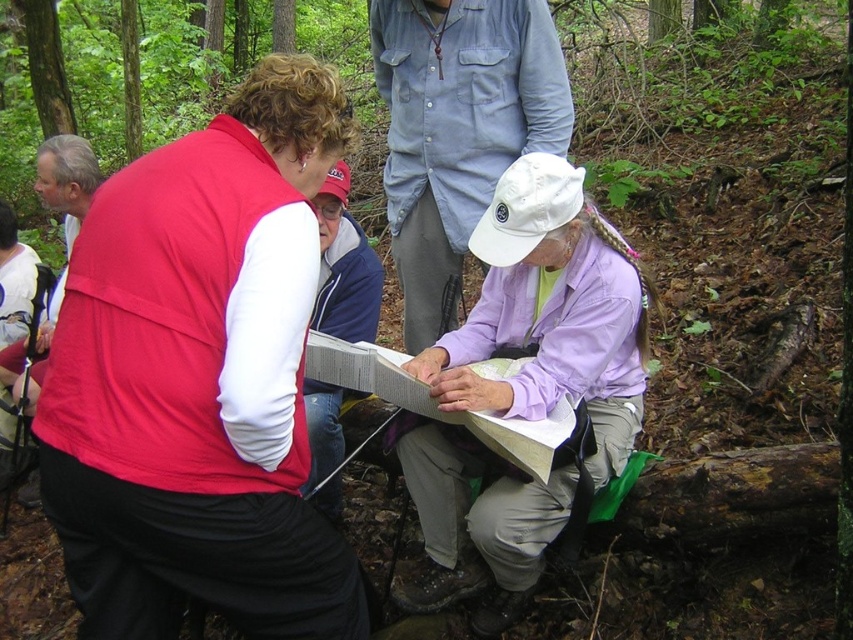
Question: Which is farther from the matte red vest at center?

Choices:
 (A) blue denim jacket at center
 (B) light blue denim shirt at upper center

Answer: (B)

Question: Observing the image, what is the correct spatial positioning of lavender fabric shirt at center in reference to light blue denim shirt at upper center?

Choices:
 (A) below
 (B) above

Answer: (A)

Question: Does lavender fabric shirt at center have a smaller size compared to white shirt at upper left?

Choices:
 (A) no
 (B) yes

Answer: (B)

Question: Which object appears farthest from the camera in this image?

Choices:
 (A) matte red vest at center
 (B) light blue denim shirt at upper center
 (C) lavender fabric shirt at center
 (D) blue denim jacket at center

Answer: (B)

Question: Can you confirm if lavender fabric shirt at center is smaller than light blue denim shirt at upper center?

Choices:
 (A) no
 (B) yes

Answer: (A)

Question: Among these objects, which one is farthest from the camera?

Choices:
 (A) blue denim jacket at center
 (B) matte red vest at center
 (C) white shirt at upper left

Answer: (C)